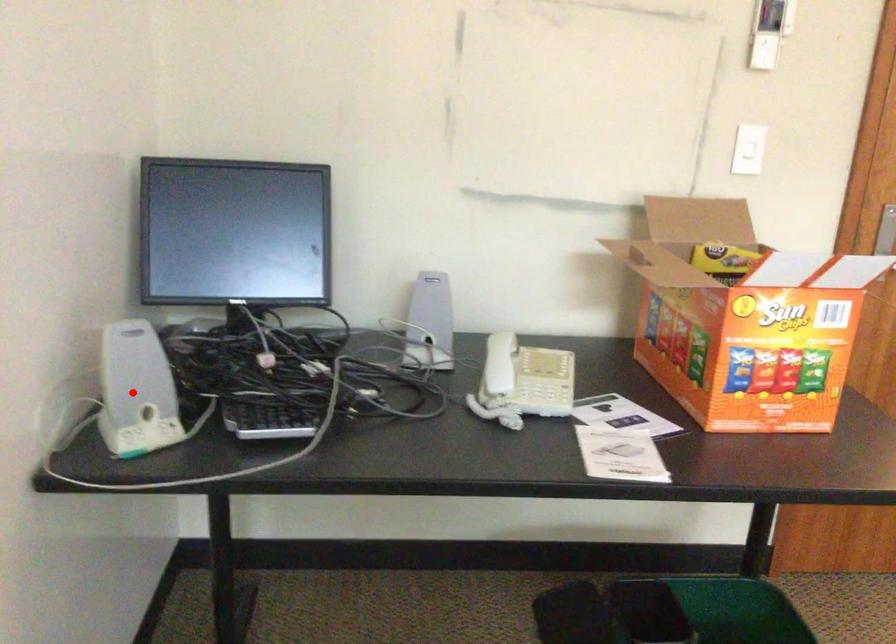
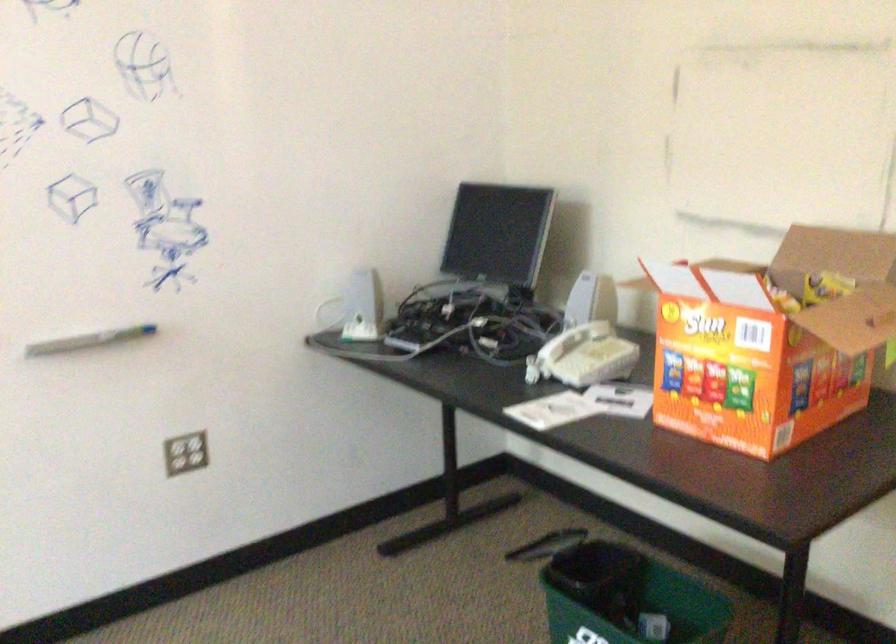
Find the pixel in the second image that matches the highlighted location in the first image.

(355, 308)